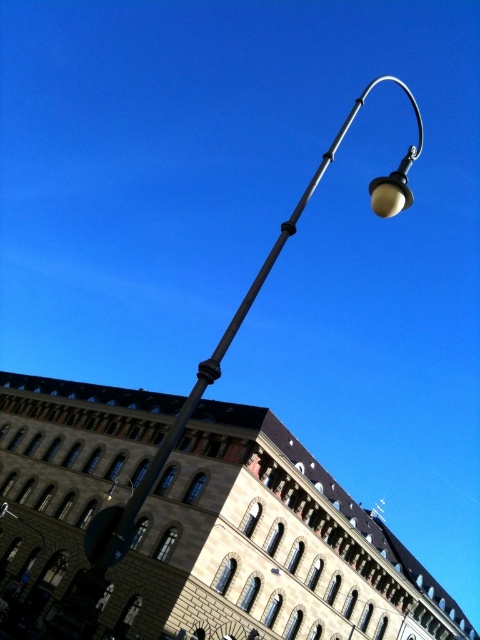
Question: Which point is closer to the camera?

Choices:
 (A) matte black streetlamp at upper center
 (B) matte black street light at upper center

Answer: (B)

Question: Can you confirm if matte black street light at upper center is smaller than matte black streetlamp at upper center?

Choices:
 (A) yes
 (B) no

Answer: (B)

Question: Among these objects, which one is nearest to the camera?

Choices:
 (A) matte black street light at upper center
 (B) matte black streetlamp at upper center

Answer: (A)

Question: Can you confirm if matte black street light at upper center is positioned above matte black streetlamp at upper center?

Choices:
 (A) yes
 (B) no

Answer: (A)

Question: Does matte black street light at upper center have a greater width compared to matte black streetlamp at upper center?

Choices:
 (A) yes
 (B) no

Answer: (A)